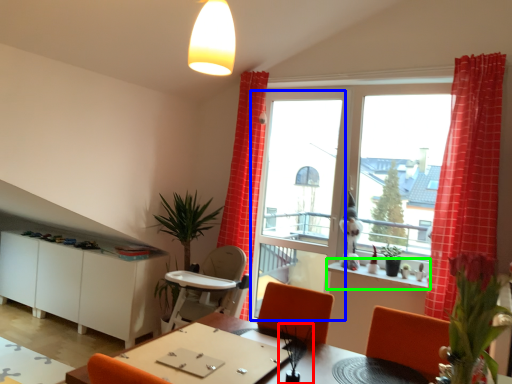
Question: Based on their relative distances, which object is farther from plant (highlighted by a red box)? Choose from screen door (highlighted by a blue box) and window sill (highlighted by a green box).

Choices:
 (A) screen door
 (B) window sill

Answer: (A)